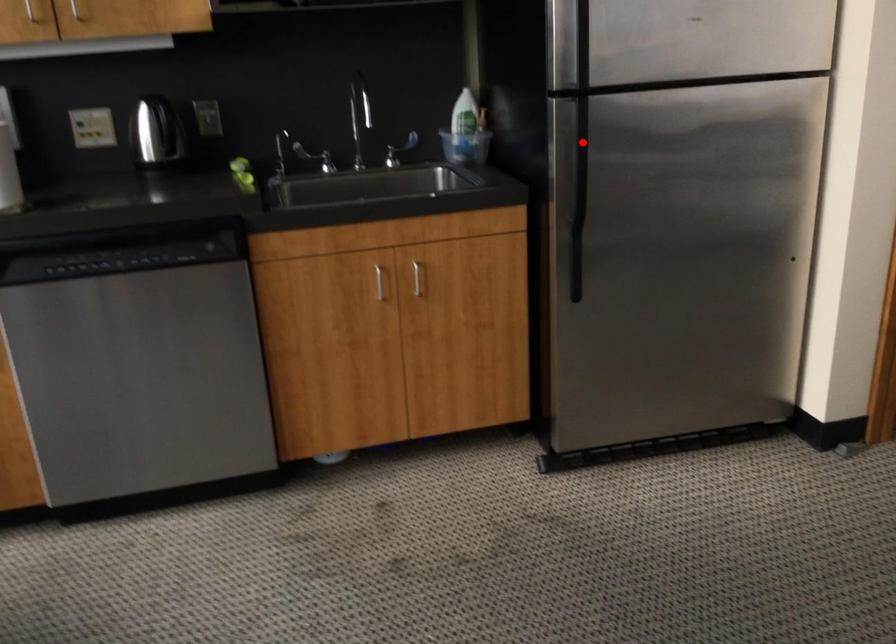
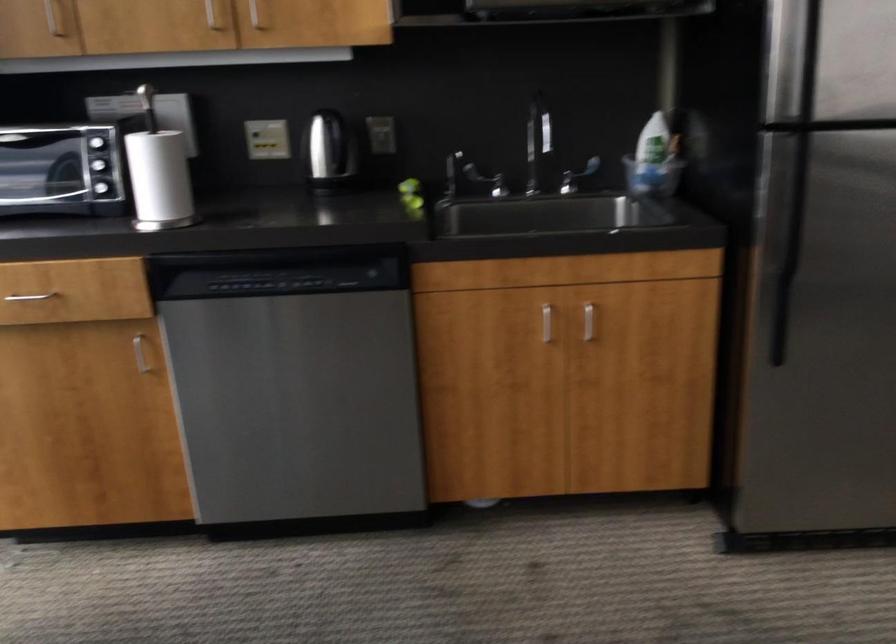
Where in the second image is the point corresponding to the highlighted location from the first image?

(797, 181)